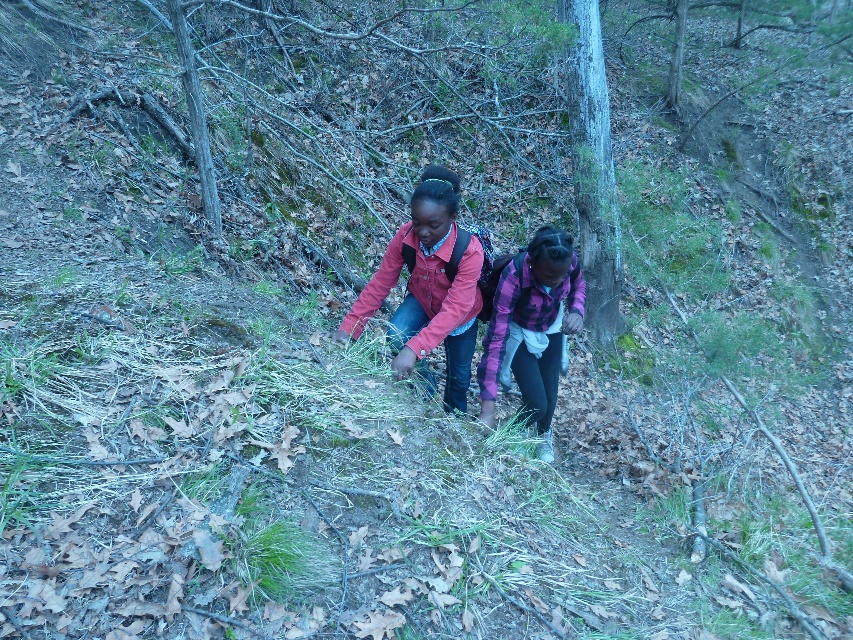
You are a photographer trying to capture both the matte pink jacket at center and the smooth gray bark at center in a single frame. Since you want both subjects to be clearly visible, which object should you focus on first to ensure it takes up more space in the photo?

You should focus on the smooth gray bark at center first because it occupies more space than the matte pink jacket at center, ensuring it is clearly visible in the photo.

You are standing at point (x=589, y=134) and want to walk towards point (x=573, y=280). Which direction should you face to move towards your destination?

You should face forward because point (x=573, y=280) is in front of point (x=589, y=134).